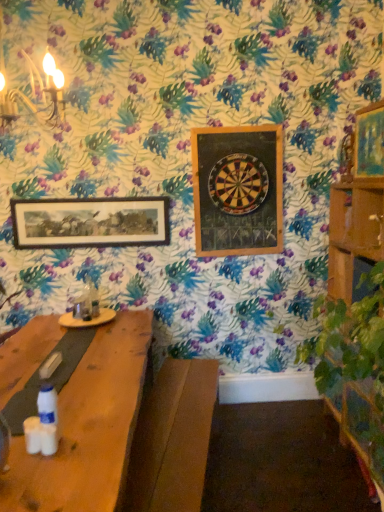
Question: Is wooden dartboard at upper center, which is the 2th picture frame in front-to-back order, bigger or smaller than matte gold picture frame at upper right, marked as the 3th picture frame in a back-to-front arrangement?

Choices:
 (A) small
 (B) big

Answer: (B)

Question: Does point (213, 142) appear closer or farther from the camera than point (362, 129)?

Choices:
 (A) farther
 (B) closer

Answer: (A)

Question: Estimate the real-world distances between objects in this image. Which object is closer to the wooden dartboard at center?

Choices:
 (A) wooden dartboard at upper center, arranged as the 2th picture frame when viewed from the right
 (B) matte gold picture frame at upper right, acting as the first picture frame starting from the right
 (C) wooden framed artwork at upper left, acting as the 1th picture frame starting from the back

Answer: (A)

Question: Estimate the real-world distances between objects in this image. Which object is closer to the wooden dartboard at upper center, which is counted as the 2th picture frame, starting from the left?

Choices:
 (A) wooden framed artwork at upper left, the 3th picture frame viewed from the right
 (B) wooden dartboard at center
 (C) matte gold picture frame at upper right, placed as the first picture frame when sorted from front to back

Answer: (B)